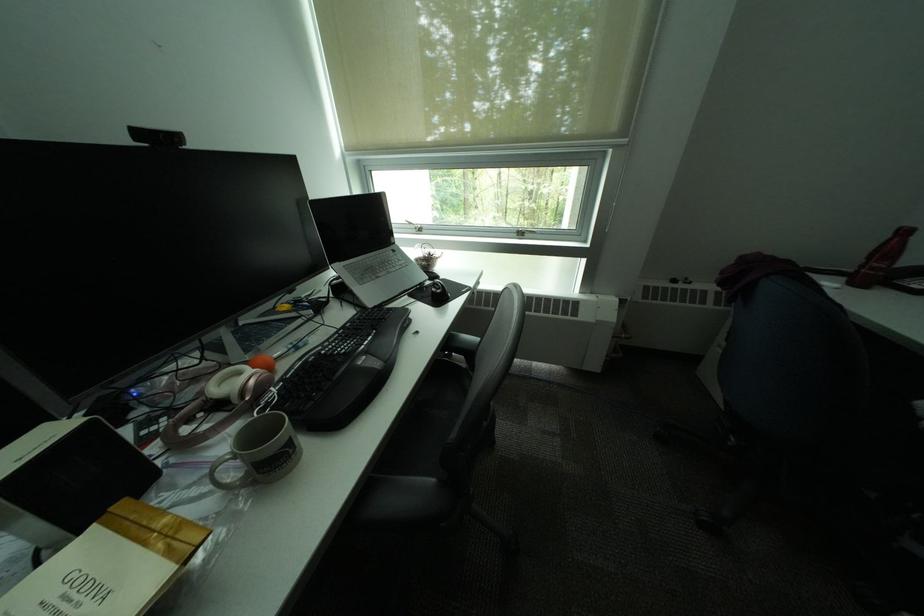
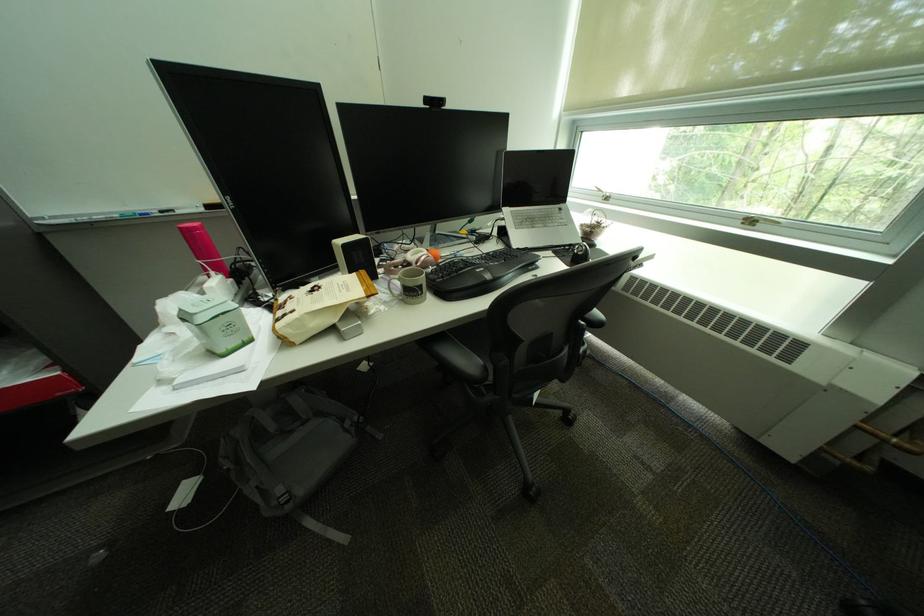
In the second image, find the point that corresponds to [347,276] in the first image.

(514, 217)